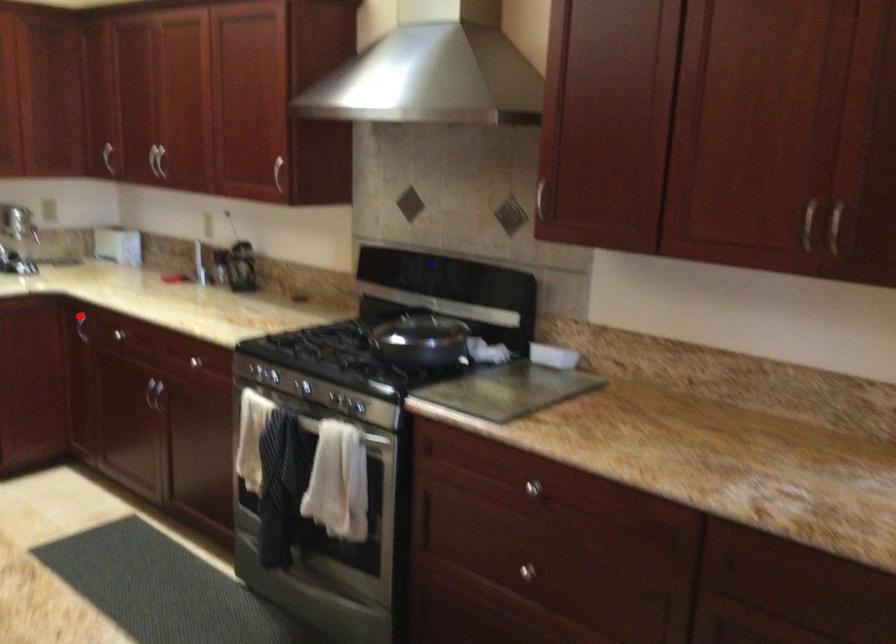
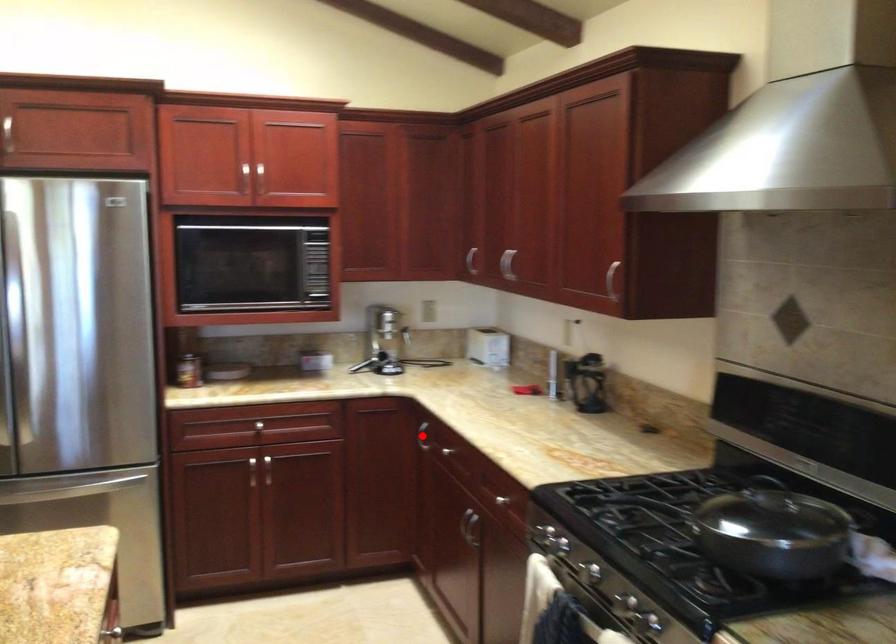
Looking at this image, I am providing you with two images of the same scene from different viewpoints. A red point is marked on the first image and another point is marked on the second image. Are the points marked in image1 and image2 representing the same 3D position?

Yes